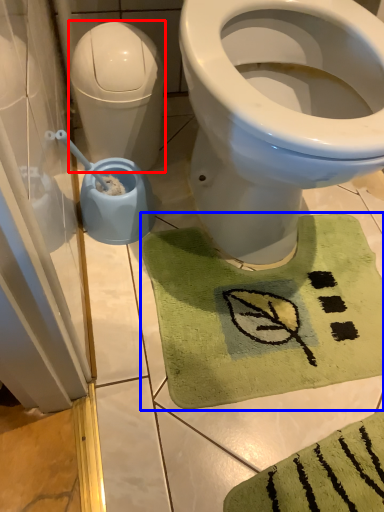
Question: Which object is further to the camera taking this photo, water tank (highlighted by a red box) or bath mat (highlighted by a blue box)?

Choices:
 (A) water tank
 (B) bath mat

Answer: (A)